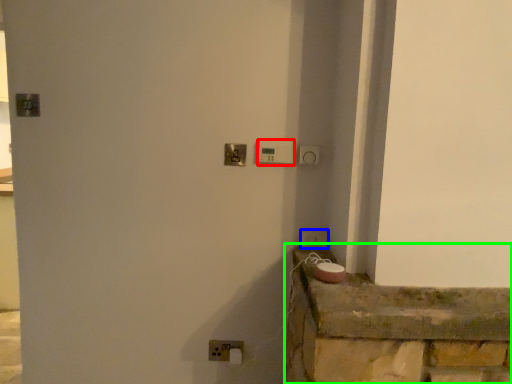
Question: Which is farther away from light switch (highlighted by a red box)? light switch (highlighted by a blue box) or ledge (highlighted by a green box)?

Choices:
 (A) light switch
 (B) ledge

Answer: (B)